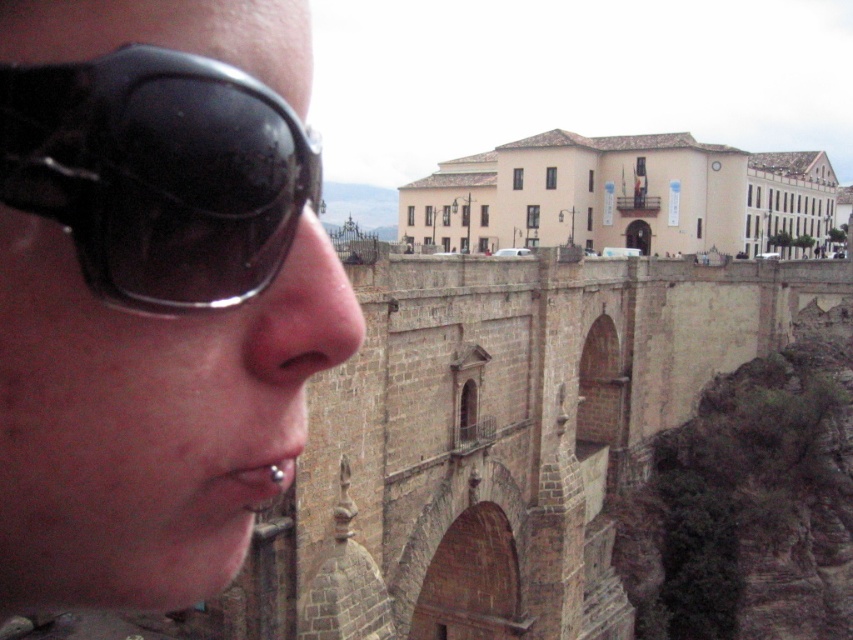
Question: Which point is closer to the camera?

Choices:
 (A) black matte sunglasses at left
 (B) silver metallic piercing at lower left
 (C) matte skin nose at center

Answer: (A)

Question: Which point is farther from the camera taking this photo?

Choices:
 (A) (206, 212)
 (B) (128, 196)

Answer: (A)

Question: Where is black matte sunglasses at left located in relation to black shiny sunglasses at left in the image?

Choices:
 (A) right
 (B) left

Answer: (B)

Question: Can you confirm if black shiny sunglasses at left is wider than matte skin nose at center?

Choices:
 (A) no
 (B) yes

Answer: (A)

Question: Which of the following is the closest to the observer?

Choices:
 (A) (283, 468)
 (B) (374, 456)
 (C) (171, 380)

Answer: (C)

Question: Can you confirm if black shiny sunglasses at left is smaller than silver metallic piercing at lower left?

Choices:
 (A) yes
 (B) no

Answer: (A)